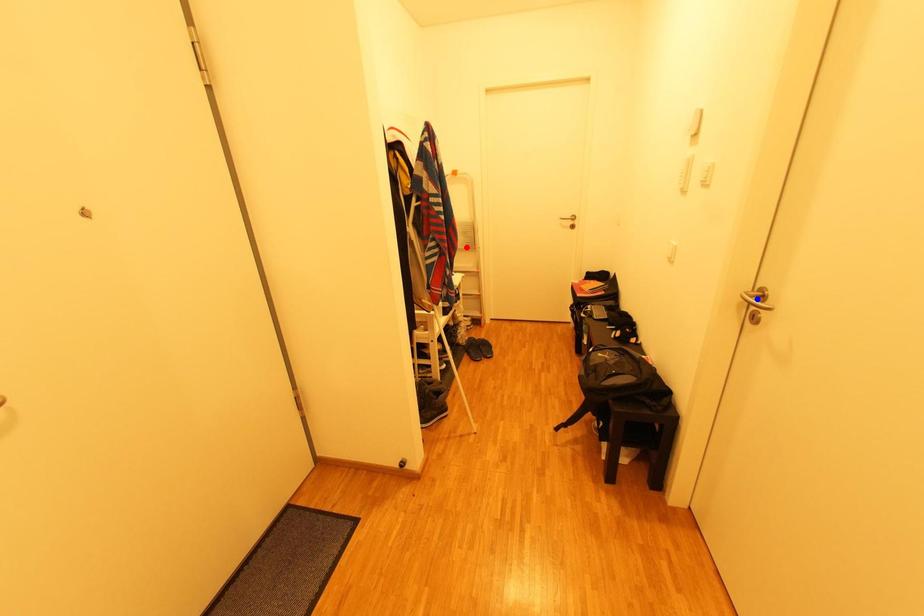
Question: In the image, two points are highlighted. Which point is nearer to the camera? Reply with the corresponding letter.

Choices:
 (A) blue point
 (B) red point

Answer: (A)